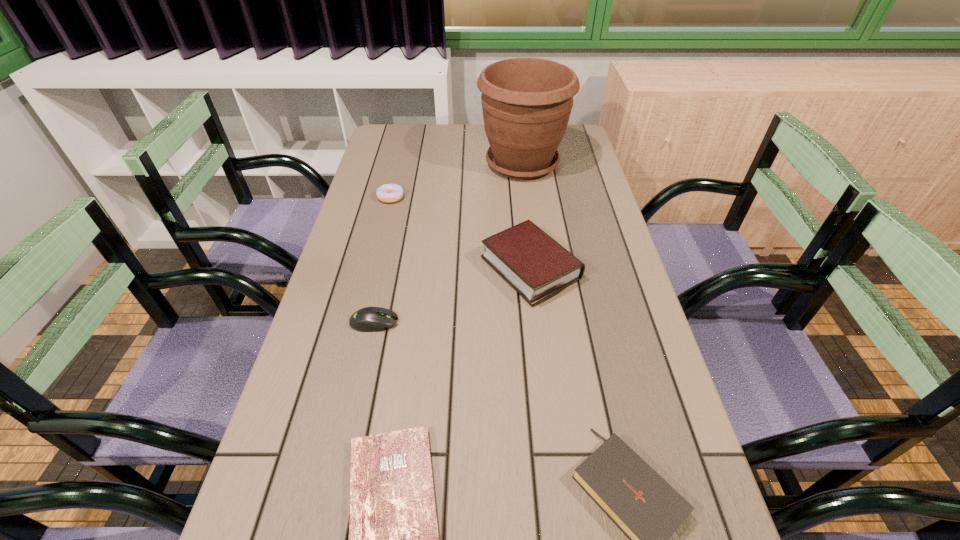
Where is `the farthest object`? the farthest object is located at coordinates (526, 102).

At what (x,y) coordinates should I click in order to perform the action: click on flowerpot. Please return your answer as a coordinate pair (x, y). Looking at the image, I should click on (526, 102).

Locate an element on the screen. the fifth shortest object is located at coordinates (527, 258).

Find the location of a particular element. the fourth nearest object is located at coordinates (527, 258).

Identify the location of doughnut. (389, 193).

Where is `computer mouse`? This screenshot has height=540, width=960. computer mouse is located at coordinates (369, 319).

Locate an element on the screen. This screenshot has height=540, width=960. vacant region located on the left of the tallest object is located at coordinates (390, 163).

The image size is (960, 540). Find the location of `free space located 0.390m on the left of the fifth shortest object`. free space located 0.390m on the left of the fifth shortest object is located at coordinates (336, 268).

Locate an element on the screen. free point located on the back of the fifth nearest object is located at coordinates (404, 145).

The width and height of the screenshot is (960, 540). Find the location of `vacant area situated 0.360m on the wheel side of the third nearest object`. vacant area situated 0.360m on the wheel side of the third nearest object is located at coordinates point(549,322).